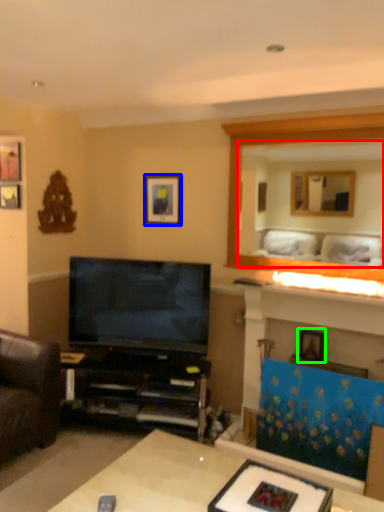
Question: Which object is positioned closest to mirror (highlighted by a red box)? Select from picture frame (highlighted by a blue box) and picture frame (highlighted by a green box).

Choices:
 (A) picture frame
 (B) picture frame

Answer: (A)